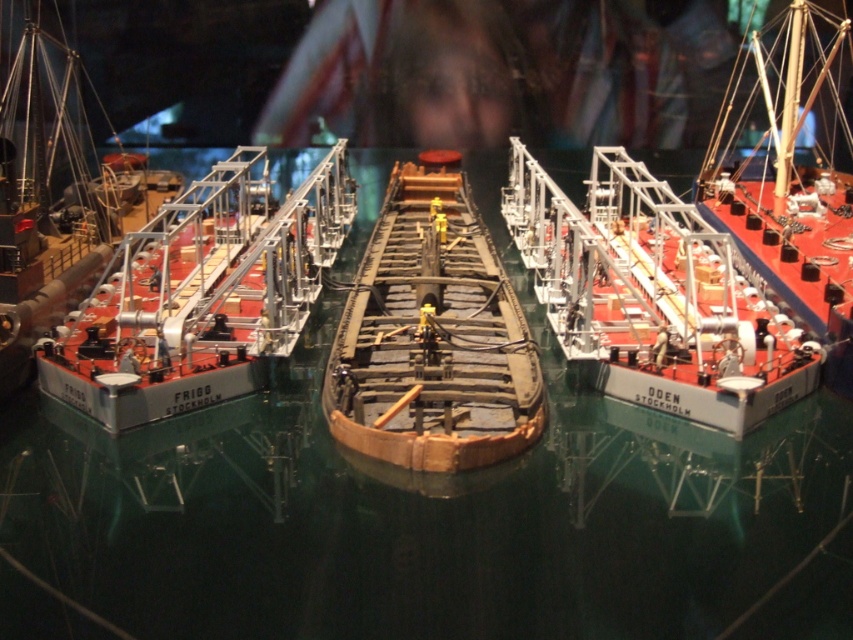
Question: Estimate the real-world distances between objects in this image. Which object is closer to the matte brown wooden boat at center?

Choices:
 (A) wooden ship at right
 (B) brown wooden boat at center

Answer: (B)

Question: Which point appears closest to the camera in this image?

Choices:
 (A) (825, 236)
 (B) (386, 326)
 (C) (173, 257)

Answer: (B)

Question: Which object is the closest to the wooden ship at right?

Choices:
 (A) brown wooden boat at center
 (B) white matte ship at center
 (C) matte brown wooden boat at center

Answer: (B)

Question: Observing the image, what is the correct spatial positioning of white matte ship at center in reference to matte brown wooden boat at center?

Choices:
 (A) below
 (B) above

Answer: (A)

Question: Can you confirm if white matte ship at center is thinner than brown wooden boat at center?

Choices:
 (A) no
 (B) yes

Answer: (A)

Question: Is brown wooden boat at center positioned behind wooden ship at right?

Choices:
 (A) no
 (B) yes

Answer: (A)